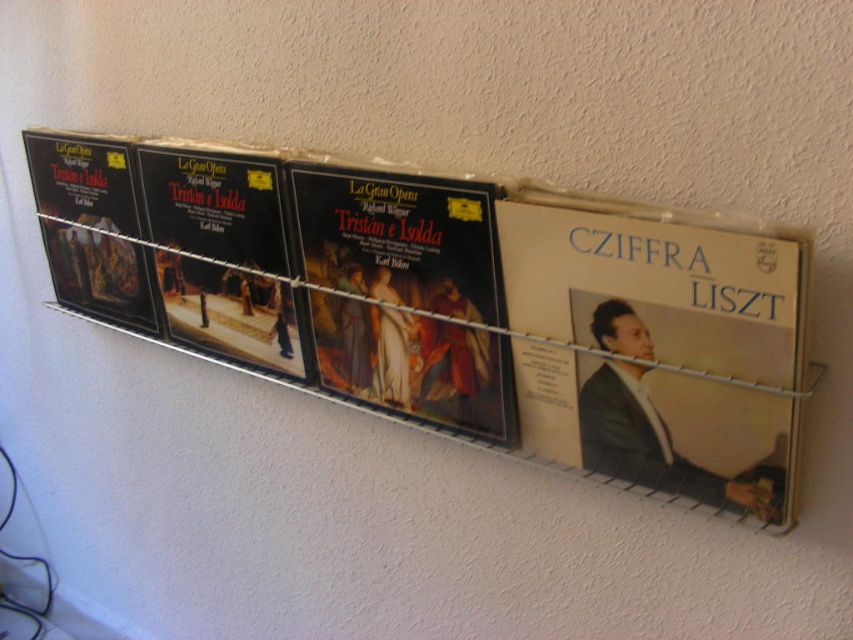
Describe the element at coordinates (405, 294) in the screenshot. I see `matte black vinyl record at center` at that location.

Between matte black vinyl record at center and black vinyl record at center, which one appears on the left side from the viewer's perspective?

black vinyl record at center is more to the left.

Is point (469, 365) in front of point (172, 157)?

Yes, it is in front of point (172, 157).

Identify the location of matte black vinyl record at center. (405, 294).

Does beige paper album at right appear over matte black vinyl record at left?

No.

Does beige paper album at right come in front of matte black vinyl record at left?

Yes.

Image resolution: width=853 pixels, height=640 pixels. I want to click on beige paper album at right, so click(656, 349).

Image resolution: width=853 pixels, height=640 pixels. In order to click on beige paper album at right in this screenshot , I will do `click(656, 349)`.

Between beige paper album at right and matte black vinyl record at center, which one appears on the right side from the viewer's perspective?

Positioned to the right is beige paper album at right.

What do you see at coordinates (656, 349) in the screenshot?
I see `beige paper album at right` at bounding box center [656, 349].

Locate an element on the screen. Image resolution: width=853 pixels, height=640 pixels. beige paper album at right is located at coordinates (656, 349).